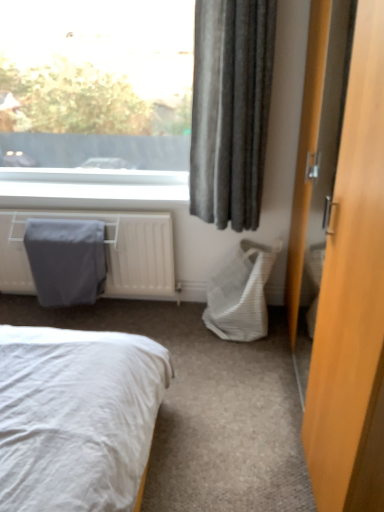
Question: From a real-world perspective, is dark grey fabric curtain at upper right located beneath gray fabric blanket at left?

Choices:
 (A) no
 (B) yes

Answer: (A)

Question: Considering the relative sizes of dark grey fabric curtain at upper right and gray fabric blanket at left in the image provided, is dark grey fabric curtain at upper right bigger than gray fabric blanket at left?

Choices:
 (A) no
 (B) yes

Answer: (B)

Question: Can you confirm if dark grey fabric curtain at upper right is shorter than gray fabric blanket at left?

Choices:
 (A) yes
 (B) no

Answer: (B)

Question: Is dark grey fabric curtain at upper right aimed at gray fabric blanket at left?

Choices:
 (A) no
 (B) yes

Answer: (A)

Question: Is the depth of dark grey fabric curtain at upper right greater than that of gray fabric blanket at left?

Choices:
 (A) no
 (B) yes

Answer: (A)

Question: Is wooden door at right taller or shorter than white woven laundry basket at lower right?

Choices:
 (A) short
 (B) tall

Answer: (B)

Question: Considering the positions of wooden door at right and white woven laundry basket at lower right in the image, is wooden door at right wider or thinner than white woven laundry basket at lower right?

Choices:
 (A) thin
 (B) wide

Answer: (B)

Question: Is point (377, 294) closer or farther from the camera than point (226, 328)?

Choices:
 (A) farther
 (B) closer

Answer: (B)

Question: In terms of size, does wooden door at right appear bigger or smaller than white woven laundry basket at lower right?

Choices:
 (A) small
 (B) big

Answer: (B)

Question: Relative to gray fabric-covered radiator at left, is white woven laundry basket at lower right in front or behind?

Choices:
 (A) front
 (B) behind

Answer: (A)

Question: Is white woven laundry basket at lower right bigger or smaller than gray fabric-covered radiator at left?

Choices:
 (A) small
 (B) big

Answer: (A)

Question: From the image's perspective, is white woven laundry basket at lower right above or below gray fabric-covered radiator at left?

Choices:
 (A) below
 (B) above

Answer: (A)

Question: From a real-world perspective, is white woven laundry basket at lower right above or below gray fabric-covered radiator at left?

Choices:
 (A) above
 (B) below

Answer: (B)

Question: Which is correct: white woven laundry basket at lower right is inside gray fabric blanket at left, or outside of it?

Choices:
 (A) inside
 (B) outside

Answer: (B)

Question: From the image's perspective, is white woven laundry basket at lower right located above or below gray fabric blanket at left?

Choices:
 (A) below
 (B) above

Answer: (A)